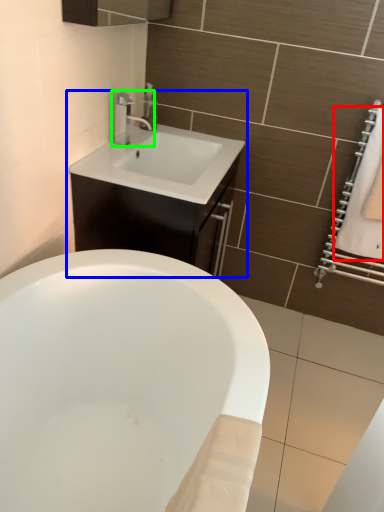
Question: Estimate the real-world distances between objects in this image. Which object is farther from bath towel (highlighted by a red box), bathroom cabinet (highlighted by a blue box) or tap (highlighted by a green box)?

Choices:
 (A) bathroom cabinet
 (B) tap

Answer: (B)